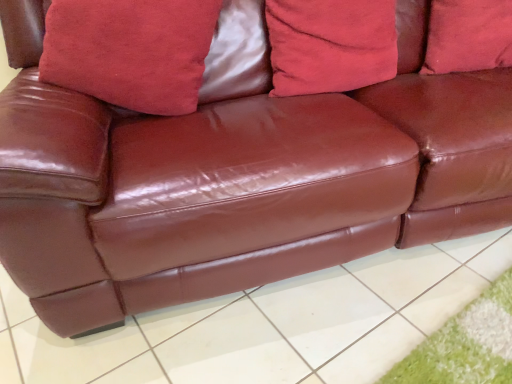
Question: In which direction should I rotate to look at suede-like red pillow at upper center, the 1th pillow from the left?

Choices:
 (A) left
 (B) right

Answer: (A)

Question: Does shiny brown leather couch at center have a greater height compared to velvet red pillow at center, which ranks as the second pillow in right-to-left order?

Choices:
 (A) no
 (B) yes

Answer: (A)

Question: Considering the relative sizes of shiny brown leather couch at center and velvet red pillow at center, which ranks as the second pillow in right-to-left order, in the image provided, is shiny brown leather couch at center smaller than velvet red pillow at center, which ranks as the second pillow in right-to-left order,?

Choices:
 (A) no
 (B) yes

Answer: (A)

Question: Can you confirm if shiny brown leather couch at center is bigger than velvet red pillow at center, which ranks as the second pillow in right-to-left order?

Choices:
 (A) no
 (B) yes

Answer: (B)

Question: Is shiny brown leather couch at center next to velvet red pillow at center, acting as the second pillow starting from the left?

Choices:
 (A) yes
 (B) no

Answer: (B)

Question: Can you confirm if shiny brown leather couch at center is shorter than velvet red pillow at center, which ranks as the second pillow in right-to-left order?

Choices:
 (A) yes
 (B) no

Answer: (A)

Question: Is shiny brown leather couch at center positioned far away from velvet red pillow at center, acting as the second pillow starting from the left?

Choices:
 (A) yes
 (B) no

Answer: (B)

Question: Is velvet red pillow at center, acting as the second pillow starting from the left, facing away from shiny brown leather couch at center?

Choices:
 (A) no
 (B) yes

Answer: (A)

Question: From the image's perspective, is velvet red pillow at center, which ranks as the second pillow in right-to-left order, over shiny brown leather couch at center?

Choices:
 (A) yes
 (B) no

Answer: (A)

Question: Is the depth of velvet red pillow at center, which ranks as the second pillow in right-to-left order, greater than that of shiny brown leather couch at center?

Choices:
 (A) no
 (B) yes

Answer: (B)

Question: Is velvet red pillow at center, acting as the second pillow starting from the left, far away from shiny brown leather couch at center?

Choices:
 (A) no
 (B) yes

Answer: (A)

Question: Can you confirm if velvet red pillow at center, acting as the second pillow starting from the left, is taller than shiny brown leather couch at center?

Choices:
 (A) yes
 (B) no

Answer: (A)

Question: Can you confirm if velvet red pillow at center, acting as the second pillow starting from the left, is positioned to the left of shiny brown leather couch at center?

Choices:
 (A) yes
 (B) no

Answer: (B)

Question: From a real-world perspective, is suede-like red pillow at upper center, arranged as the third pillow when viewed from the right, below suede-like red pillow at upper center, which ranks as the third pillow in left-to-right order?

Choices:
 (A) yes
 (B) no

Answer: (B)